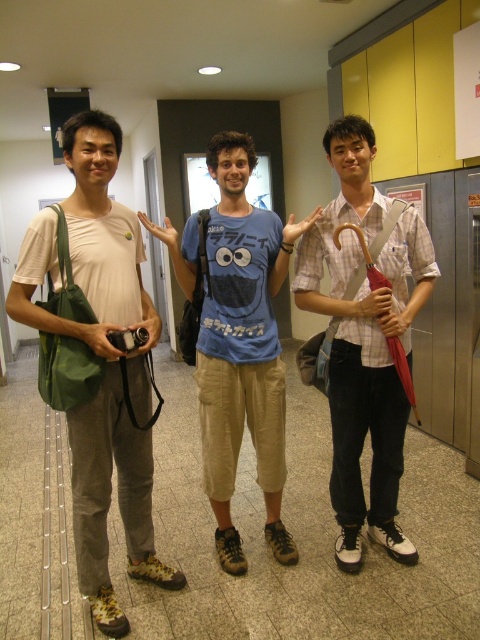
You are planning to place a rectangular box that is 1.2 meters wide on a shelf. The shelf can only hold items narrower than 1 meter. You see the matte green bag at left and the plaid cotton shirt at center. Which item, if either, can fit on the shelf without exceeding the width limit?

The matte green bag at left has a lesser width compared to the plaid cotton shirt at center. Since the shelf can only hold items narrower than 1 meter, the matte green bag at left may fit, but the plaid cotton shirt at center is wider and would exceed the limit. However, without knowing the exact width measurements, we cannot confirm if the bag itself is under 1 meter. The description only states the relative sizes between the two items.

You are a delivery robot with a 1.5 meter long package. You need to move from the entrance to the exit in the hallway shown. The entrance is behind you, and the exit is straight ahead. There is a matte green bag at left in your path. Can you navigate around it without hitting the package?

The distance between the matte green bag at left and the viewer is 1.72 meters. Since the package is 1.5 meters long, the robot can safely navigate around the matte green bag at left as the available space is greater than the package length.